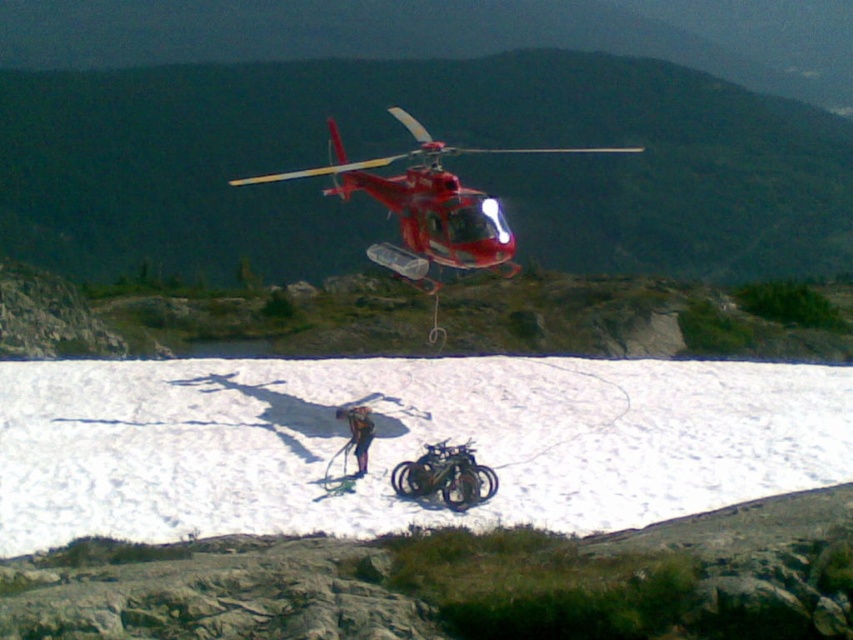
Question: Based on their relative distances, which object is farther from the white powder snow at center?

Choices:
 (A) shiny red helicopter at center
 (B) shiny metallic motorcycle at center
 (C) brown leather jacket at center

Answer: (A)

Question: Can you confirm if shiny red helicopter at center is smaller than shiny metallic motorcycle at center?

Choices:
 (A) yes
 (B) no

Answer: (B)

Question: Considering the real-world distances, which object is farthest from the shiny red helicopter at center?

Choices:
 (A) shiny metallic motorcycle at center
 (B) white powder snow at center

Answer: (B)

Question: Which object is farther from the camera taking this photo?

Choices:
 (A) shiny metallic motorcycle at center
 (B) white powder snow at center
 (C) brown leather jacket at center

Answer: (C)

Question: Does white powder snow at center lie in front of shiny metallic motorcycle at center?

Choices:
 (A) no
 (B) yes

Answer: (B)

Question: Is shiny red helicopter at center to the left of brown leather jacket at center from the viewer's perspective?

Choices:
 (A) yes
 (B) no

Answer: (B)